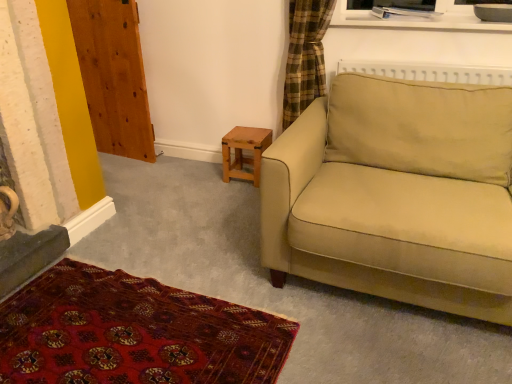
Question: Considering the positions of point tap(136, 3) and point tap(194, 347), is point tap(136, 3) closer or farther from the camera than point tap(194, 347)?

Choices:
 (A) farther
 (B) closer

Answer: (A)

Question: From a real-world perspective, is wooden at left above or below carpet with intricate patterns at lower left?

Choices:
 (A) above
 (B) below

Answer: (A)

Question: Which object is positioned farthest from the beige fabric couch at right?

Choices:
 (A) wooden at left
 (B) carpet with intricate patterns at lower left
 (C) wooden stool at lower center

Answer: (A)

Question: Estimate the real-world distances between objects in this image. Which object is closer to the carpet with intricate patterns at lower left?

Choices:
 (A) wooden stool at lower center
 (B) wooden at left
 (C) beige fabric couch at right

Answer: (C)